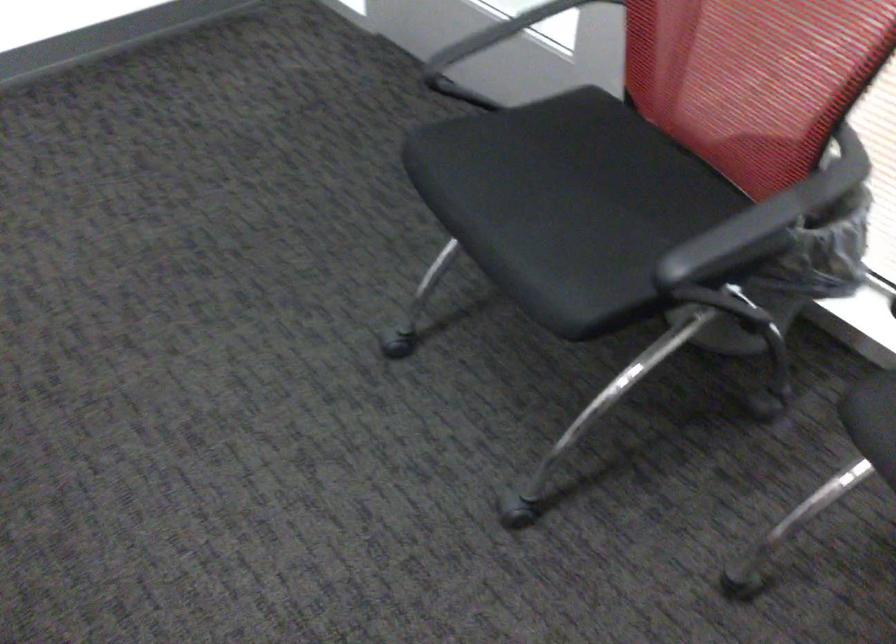
Consider the image. Based on the continuous images, in which direction is the camera rotating?

The camera's rotation is toward right-down.